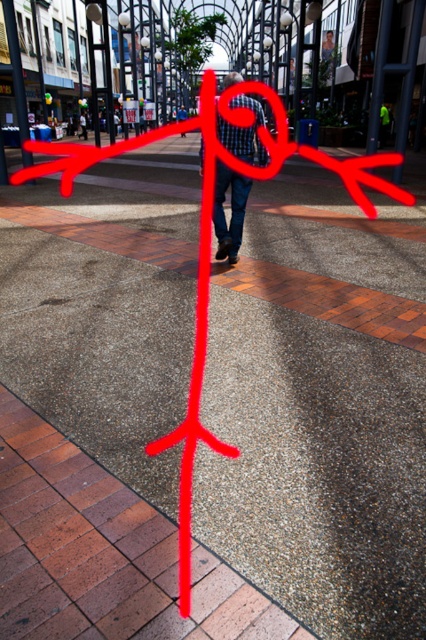
You are a fashion designer observing a person walking away from you in the plaza. You notice the checkered fabric shirt at center and the denim jeans at center. Which clothing item is positioned lower on the person?

The checkered fabric shirt at center is below denim jeans at center, so the checkered fabric shirt at center is positioned lower on the person.